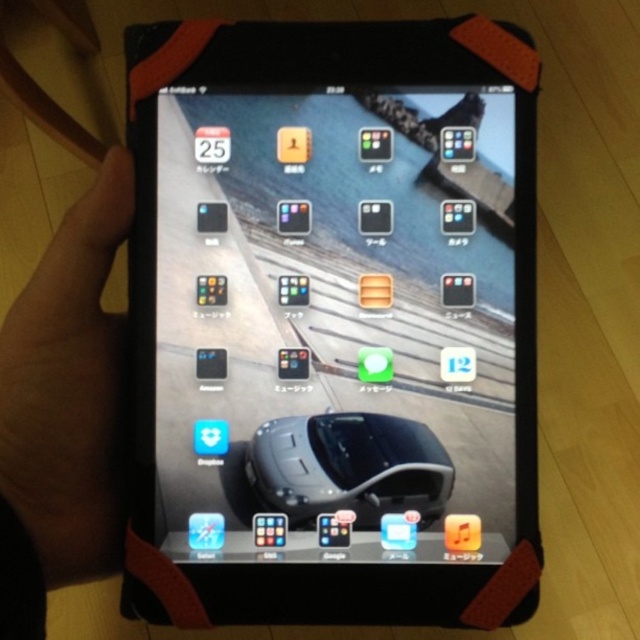
Does dark skin at lower left have a larger size compared to satin black mouse at center?

Correct, dark skin at lower left is larger in size than satin black mouse at center.

Who is taller, dark skin at lower left or satin black mouse at center?

dark skin at lower left is taller.

Is point (67, 220) more distant than point (298, 524)?

No, (67, 220) is in front of (298, 524).

Locate an element on the screen. dark skin at lower left is located at coordinates (68, 388).

Is black plastic tablet at center to the right of satin black mouse at center from the viewer's perspective?

Incorrect, black plastic tablet at center is not on the right side of satin black mouse at center.

Which is in front, point (435, 132) or point (250, 449)?

Positioned in front is point (250, 449).

Does point (440, 176) come behind point (323, 490)?

Yes, point (440, 176) is farther from viewer.

Find the location of a particular element. This screenshot has width=640, height=640. black plastic tablet at center is located at coordinates (332, 321).

Between black plastic tablet at center and dark skin at lower left, which one appears on the right side from the viewer's perspective?

black plastic tablet at center is more to the right.

Which is more to the left, black plastic tablet at center or dark skin at lower left?

From the viewer's perspective, dark skin at lower left appears more on the left side.

The height and width of the screenshot is (640, 640). I want to click on black plastic tablet at center, so click(332, 321).